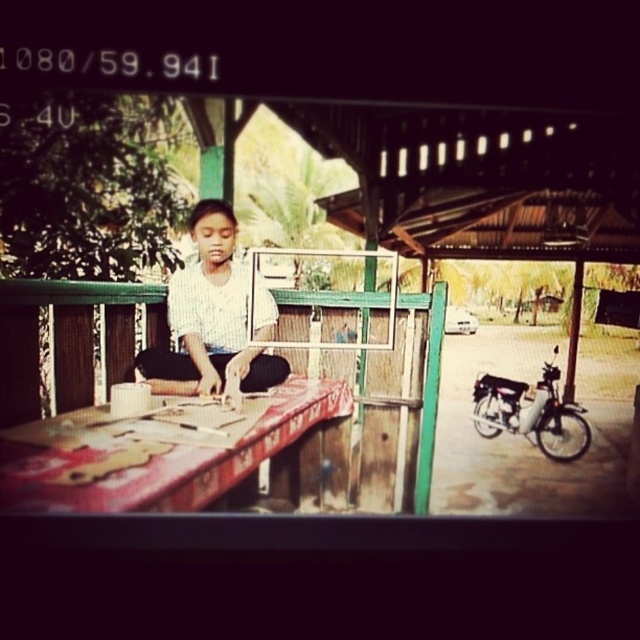
You are a customer approaching the stall. You see the wooden table at center and the white striped shirt at center. Which object is closer to you as you approach the stall?

The wooden table at center is closer to you because it is positioned under the white striped shirt at center, meaning the shirt is above the table.

You are standing at the entrance of the wooden stall and see the point marked at coordinates (150, 456). Where would you find this point in the scene?

The point marked at coordinates (150, 456) is located on the wooden table at center.

You are standing in front of the wooden table at center and the white striped shirt at center. Which object is positioned more to the left?

The wooden table at center is positioned more to the left than the white striped shirt at center.